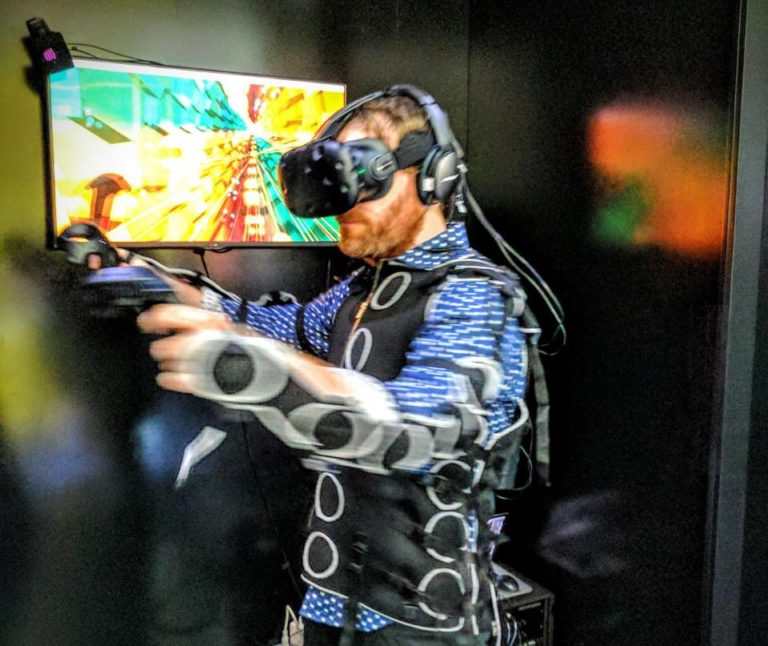
Identify the location of table with mouse and a sliver of laptop screen. This screenshot has width=768, height=646. (528, 592), (492, 523), (511, 583).